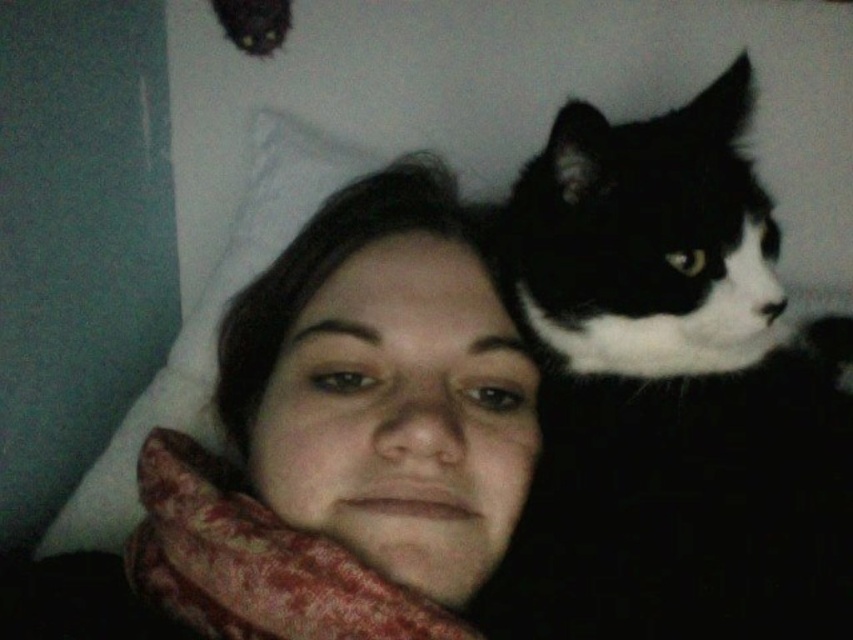
Question: Which point appears farthest from the camera in this image?

Choices:
 (A) (618, 353)
 (B) (241, 244)

Answer: (B)

Question: Is black and white fur at upper right in front of white soft pillow at upper left?

Choices:
 (A) no
 (B) yes

Answer: (B)

Question: Which of the following is the closest to the observer?

Choices:
 (A) white soft pillow at upper left
 (B) black and white fur at upper right

Answer: (B)

Question: Does black and white fur at upper right appear over white soft pillow at upper left?

Choices:
 (A) yes
 (B) no

Answer: (B)

Question: Does black and white fur at upper right appear on the right side of white soft pillow at upper left?

Choices:
 (A) yes
 (B) no

Answer: (A)